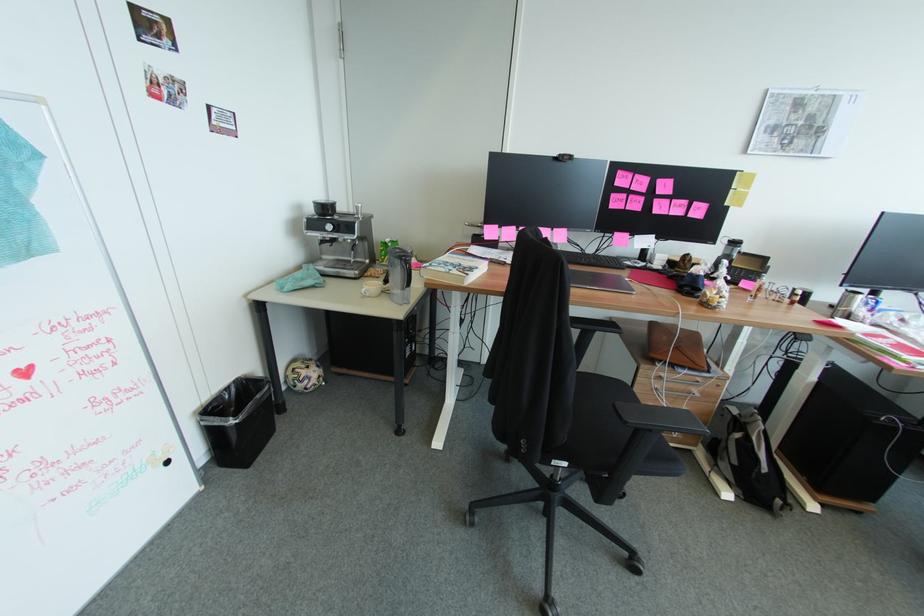
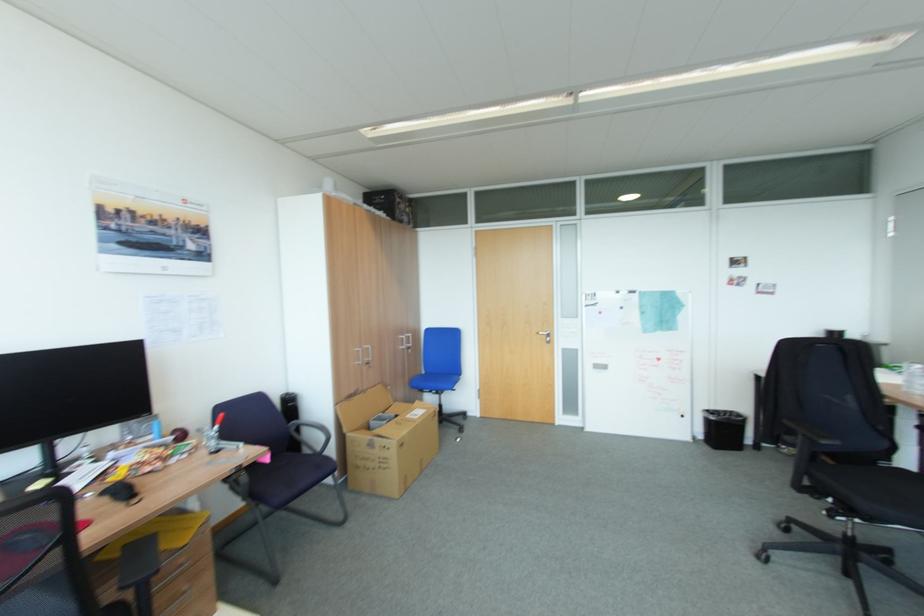
Find the pixel in the second image that matches point (239, 382) in the first image.

(736, 411)